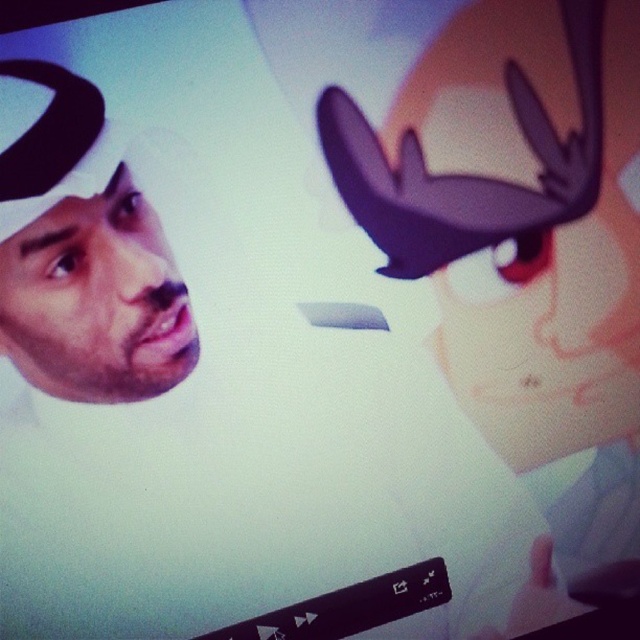
You are a photographer trying to focus on the two points on the screen. Which point, point [564,333] or point [81,352], is closer to the camera?

Point [564,333] is further to the camera than point [81,352], so the closer point to the camera is point [81,352].

You are an art student analyzing the screen showing two faces. You notice a matte purple hat at upper right and a matte white headscarf at left. Which object is positioned more to the right side of the screen?

The matte purple hat at upper right is positioned more to the right side of the screen than the matte white headscarf at left.

You are designing a poster and need to place the matte purple hat at upper right and the matte white headscarf at left. Given their sizes, which object should you place closer to the center of the poster to maintain visual balance?

The matte purple hat at upper right is larger in size compared to the matte white headscarf at left. To maintain visual balance, the larger matte purple hat at upper right should be placed closer to the center of the poster, while the smaller matte white headscarf at left can be positioned farther away.